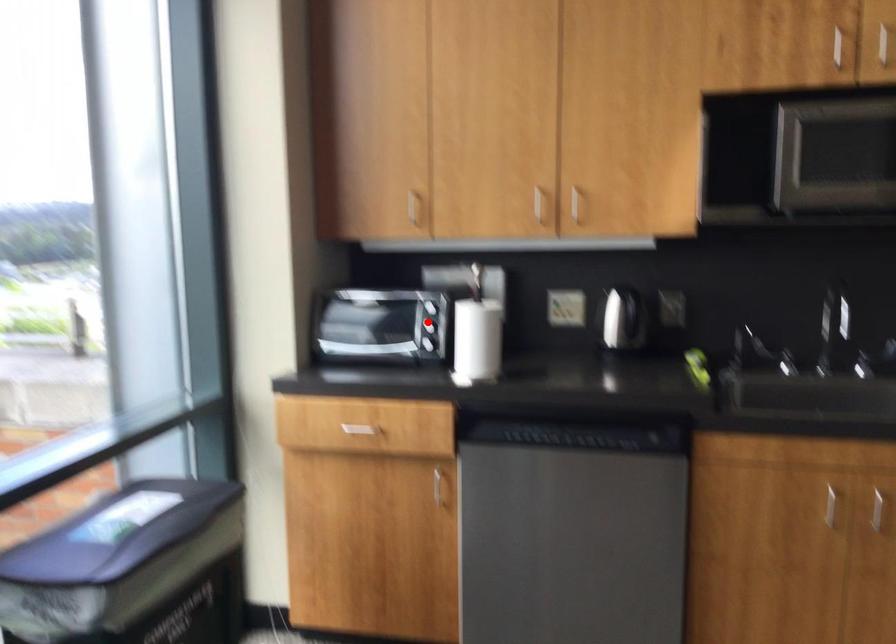
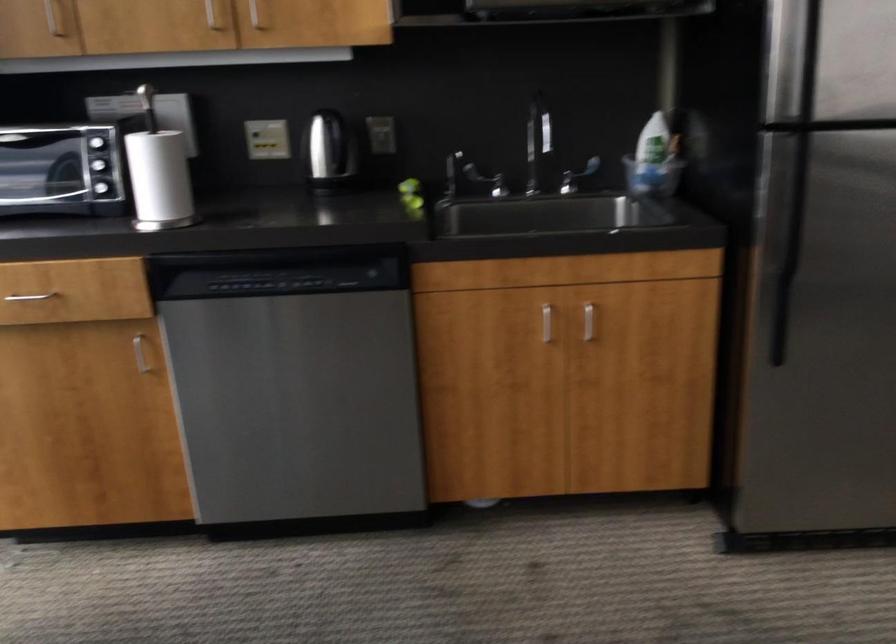
Question: I am providing you with two images of the same scene from different viewpoints. Given a red point in image1, look at the same physical point in image2. Is it:

Choices:
 (A) Closer to the viewpoint
 (B) Farther from the viewpoint

Answer: (A)